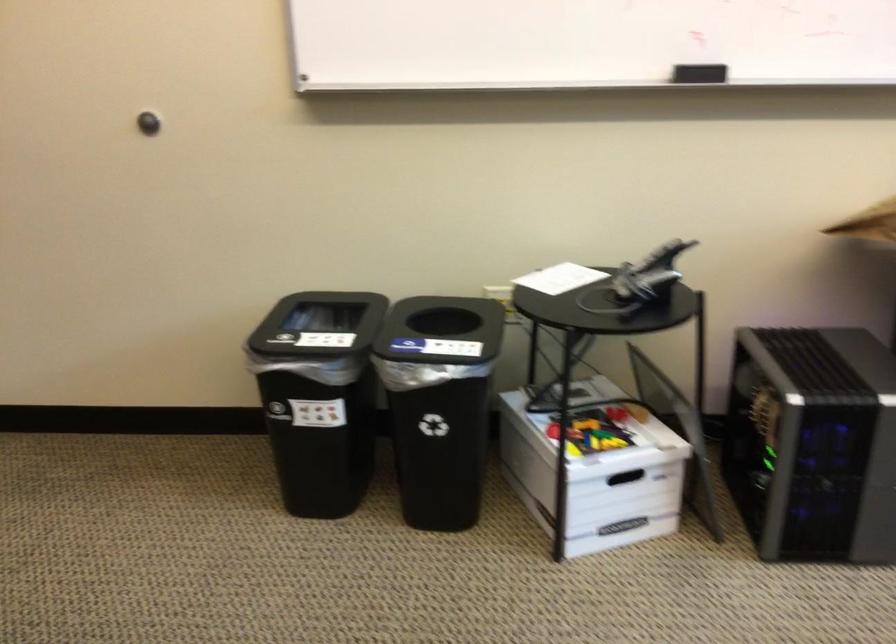
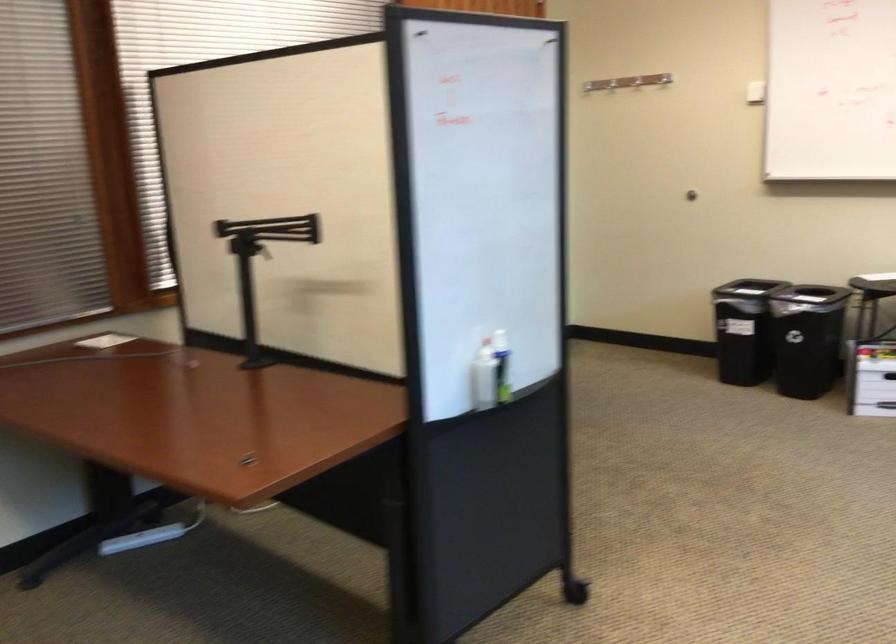
In the second image, find the point that corresponds to the point at 460,462 in the first image.

(744, 330)